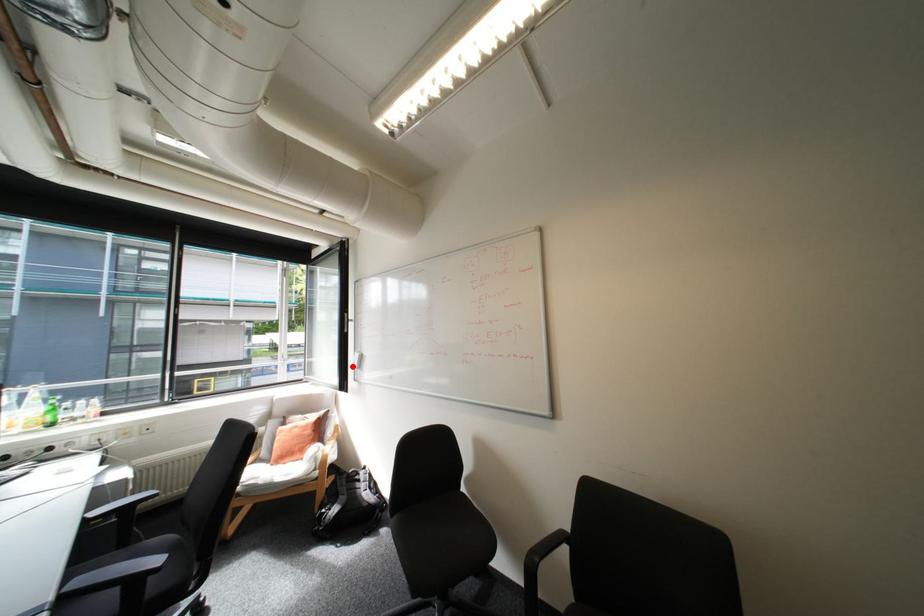
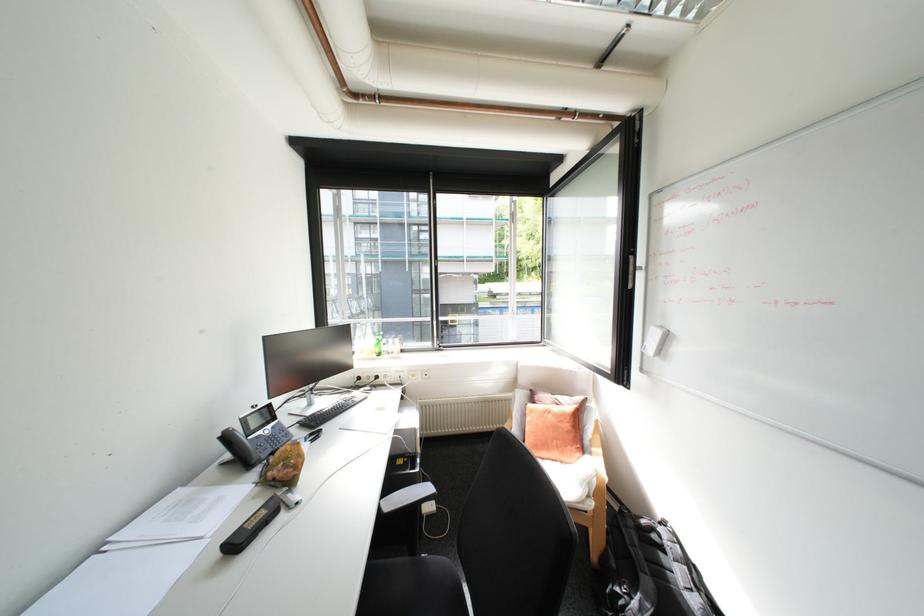
Where in the second image is the point corresponding to the highlighted location from the first image?

(633, 346)